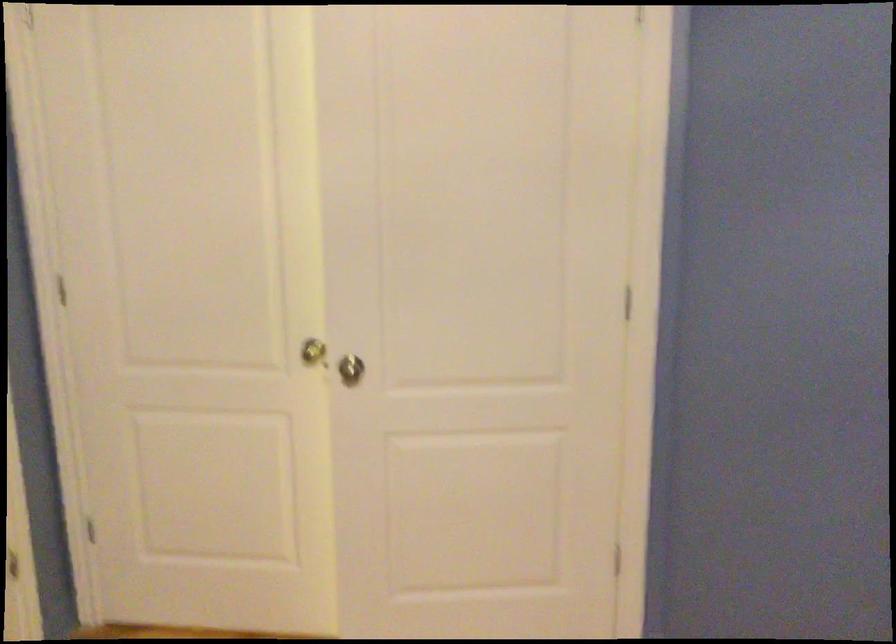
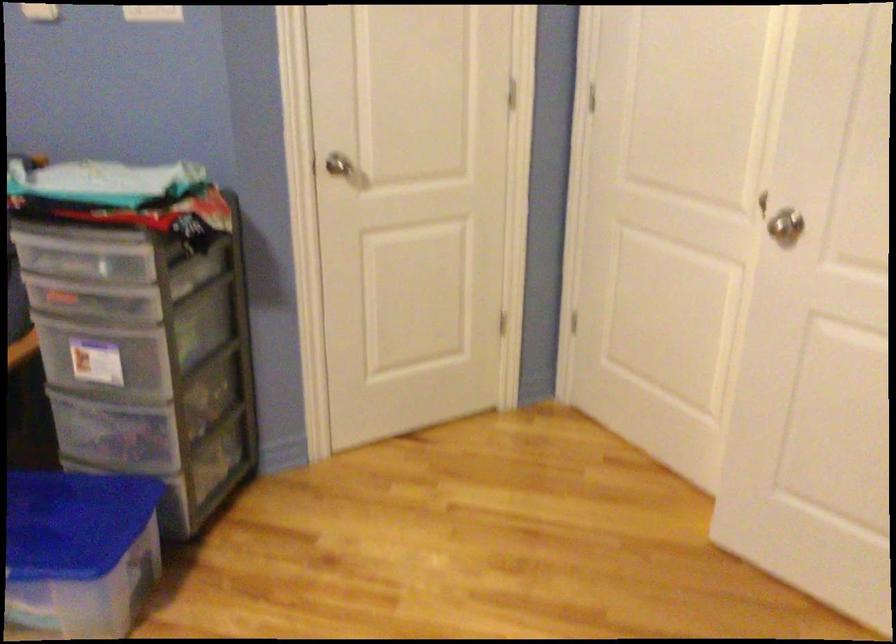
The first image is from the beginning of the video and the second image is from the end. How did the camera likely rotate when shooting the video?

The camera's rotation is toward left-down.